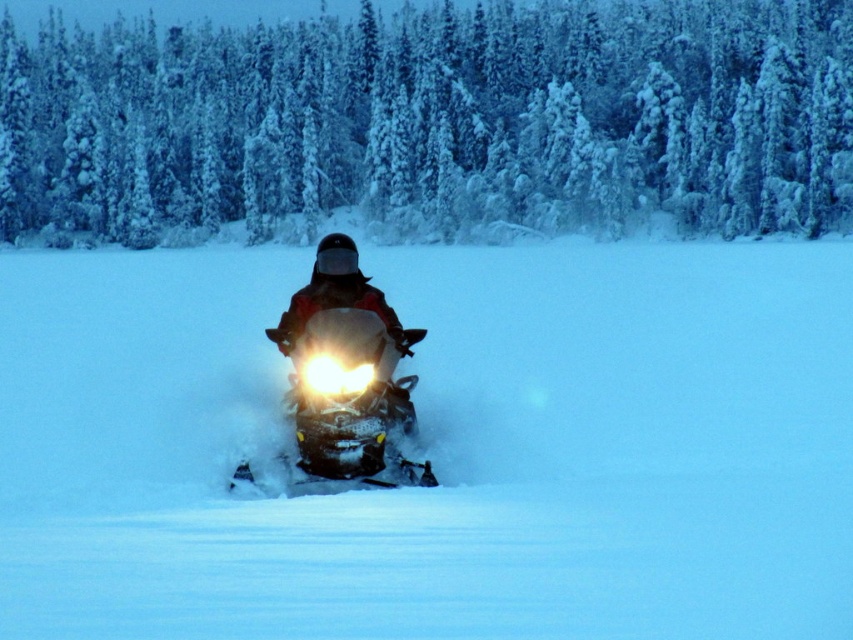
I want to click on white powdery snow at center, so pyautogui.click(x=437, y=448).

Identify the location of white powdery snow at center. This screenshot has height=640, width=853. tap(437, 448).

Which is more to the right, shiny metallic snowmobile at center or bright white plastic headlight at center?

From the viewer's perspective, shiny metallic snowmobile at center appears more on the right side.

Does shiny metallic snowmobile at center have a larger size compared to bright white plastic headlight at center?

Correct, shiny metallic snowmobile at center is larger in size than bright white plastic headlight at center.

This screenshot has width=853, height=640. What do you see at coordinates (350, 397) in the screenshot?
I see `shiny metallic snowmobile at center` at bounding box center [350, 397].

Where is `shiny metallic snowmobile at center`? This screenshot has width=853, height=640. shiny metallic snowmobile at center is located at coordinates (350, 397).

Does point (660, 536) come closer to viewer compared to point (308, 381)?

Yes.

Is point (125, 342) behind point (306, 403)?

Yes.

Where is `white powdery snow at center`? white powdery snow at center is located at coordinates (437, 448).